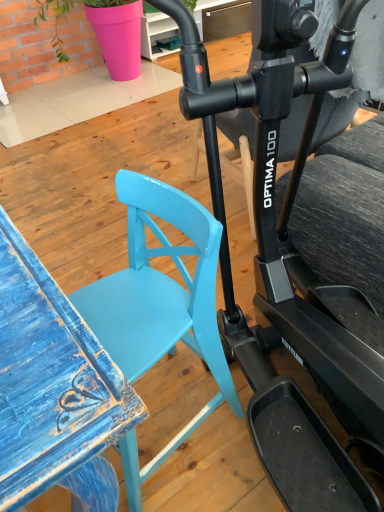
What do you see at coordinates (159, 306) in the screenshot? This screenshot has height=512, width=384. I see `matte blue chair at center` at bounding box center [159, 306].

Where is `matte blue chair at center`? matte blue chair at center is located at coordinates (159, 306).

What do you see at coordinates (297, 269) in the screenshot?
I see `glossy black stationary bicycle at center` at bounding box center [297, 269].

Image resolution: width=384 pixels, height=512 pixels. I want to click on glossy black stationary bicycle at center, so click(x=297, y=269).

The height and width of the screenshot is (512, 384). I want to click on matte blue chair at center, so click(x=159, y=306).

Considering the positions of objects glossy black stationary bicycle at center and matte blue chair at center in the image provided, who is more to the left, glossy black stationary bicycle at center or matte blue chair at center?

Positioned to the left is matte blue chair at center.

Is glossy black stationary bicycle at center in front of matte blue chair at center?

Yes, glossy black stationary bicycle at center is in front of matte blue chair at center.

Which is in front, point (337, 375) or point (131, 188)?

The point (337, 375) is closer to the camera.

From the image's perspective, between glossy black stationary bicycle at center and matte blue chair at center, who is located below?

From the image's view, matte blue chair at center is below.

From a real-world perspective, is glossy black stationary bicycle at center over matte blue chair at center?

Yes, from a real-world perspective, glossy black stationary bicycle at center is over matte blue chair at center

Based on the photo, considering the sizes of objects glossy black stationary bicycle at center and matte blue chair at center in the image provided, who is wider, glossy black stationary bicycle at center or matte blue chair at center?

glossy black stationary bicycle at center.

Is glossy black stationary bicycle at center taller or shorter than matte blue chair at center?

In the image, glossy black stationary bicycle at center appears to be taller than matte blue chair at center.

Looking at the image, does glossy black stationary bicycle at center seem bigger or smaller compared to matte blue chair at center?

Considering their sizes, glossy black stationary bicycle at center takes up more space than matte blue chair at center.

Is glossy black stationary bicycle at center surrounding matte blue chair at center?

Actually, matte blue chair at center is outside glossy black stationary bicycle at center.

Is glossy black stationary bicycle at center next to matte blue chair at center and touching it?

glossy black stationary bicycle at center is not next to matte blue chair at center, and they're not touching.

Could you tell me if glossy black stationary bicycle at center is facing matte blue chair at center?

No, glossy black stationary bicycle at center is not oriented towards matte blue chair at center.

From the picture: How many degrees apart are the facing directions of glossy black stationary bicycle at center and matte blue chair at center?

There is a 115-degree angle between the facing directions of glossy black stationary bicycle at center and matte blue chair at center.

Identify the location of chair that appears below the glossy black stationary bicycle at center (from the image's perspective). (159, 306).

In the scene shown: Which object is positioned more to the left, matte blue chair at center or glossy black stationary bicycle at center?

matte blue chair at center is more to the left.

Is the position of matte blue chair at center more distant than that of glossy black stationary bicycle at center?

That is True.

Is point (214, 260) behind point (360, 354)?

No.

From the image's perspective, is matte blue chair at center below glossy black stationary bicycle at center?

Indeed, from the image's perspective, matte blue chair at center is shown beneath glossy black stationary bicycle at center.

From a real-world perspective, is matte blue chair at center located beneath glossy black stationary bicycle at center?

Yes, from a real-world perspective, matte blue chair at center is beneath glossy black stationary bicycle at center.

In terms of width, does matte blue chair at center look wider or thinner when compared to glossy black stationary bicycle at center?

Considering their sizes, matte blue chair at center looks slimmer than glossy black stationary bicycle at center.

Considering the sizes of objects matte blue chair at center and glossy black stationary bicycle at center in the image provided, who is taller, matte blue chair at center or glossy black stationary bicycle at center?

With more height is glossy black stationary bicycle at center.

Which of these two, matte blue chair at center or glossy black stationary bicycle at center, is smaller?

With smaller size is matte blue chair at center.

Would you say matte blue chair at center is outside glossy black stationary bicycle at center?

Indeed, matte blue chair at center is completely outside glossy black stationary bicycle at center.

Is matte blue chair at center not close to glossy black stationary bicycle at center?

No, matte blue chair at center is in close proximity to glossy black stationary bicycle at center.

Is matte blue chair at center oriented towards glossy black stationary bicycle at center?

No, matte blue chair at center is not turned towards glossy black stationary bicycle at center.

This screenshot has height=512, width=384. In order to click on stationary bicycle lying above the matte blue chair at center (from the image's perspective) in this screenshot , I will do `click(297, 269)`.

At what (x,y) coordinates should I click in order to perform the action: click on stationary bicycle above the matte blue chair at center (from the image's perspective). Please return your answer as a coordinate pair (x, y). The height and width of the screenshot is (512, 384). Looking at the image, I should click on (297, 269).

The image size is (384, 512). I want to click on chair behind the glossy black stationary bicycle at center, so click(x=159, y=306).